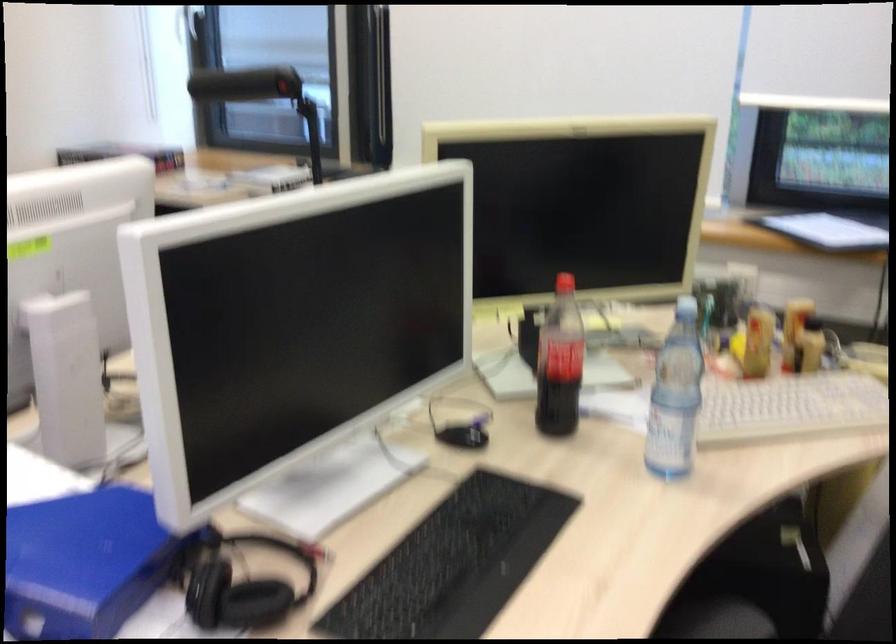
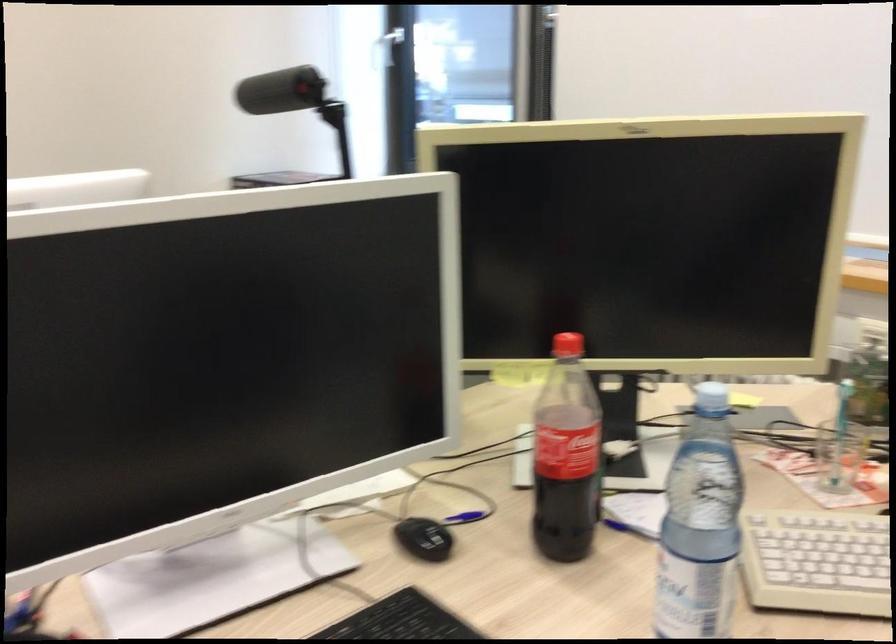
The point at (250, 88) is marked in the first image. Where is the corresponding point in the second image?

(280, 91)